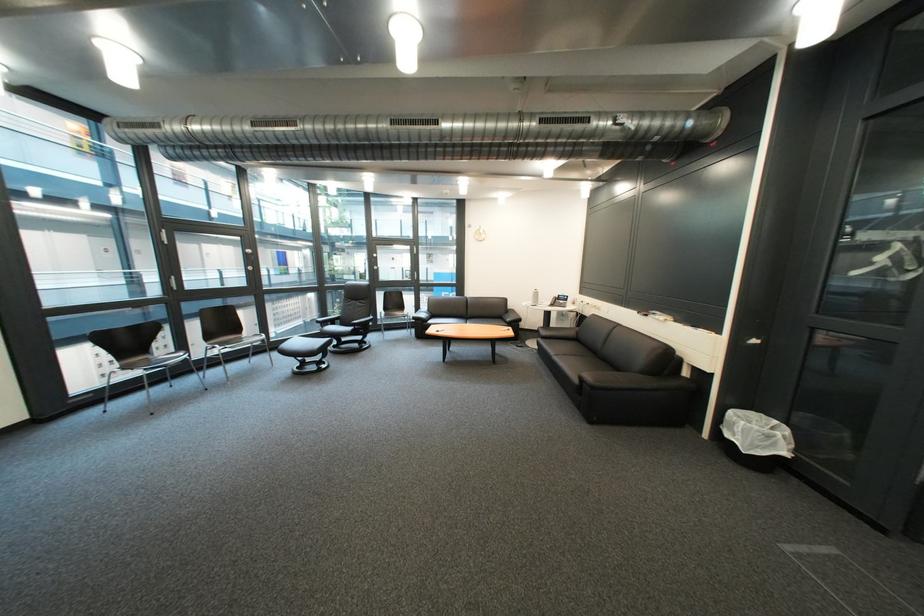
Where is `white water bottle`? The height and width of the screenshot is (616, 924). white water bottle is located at coordinates (535, 297).